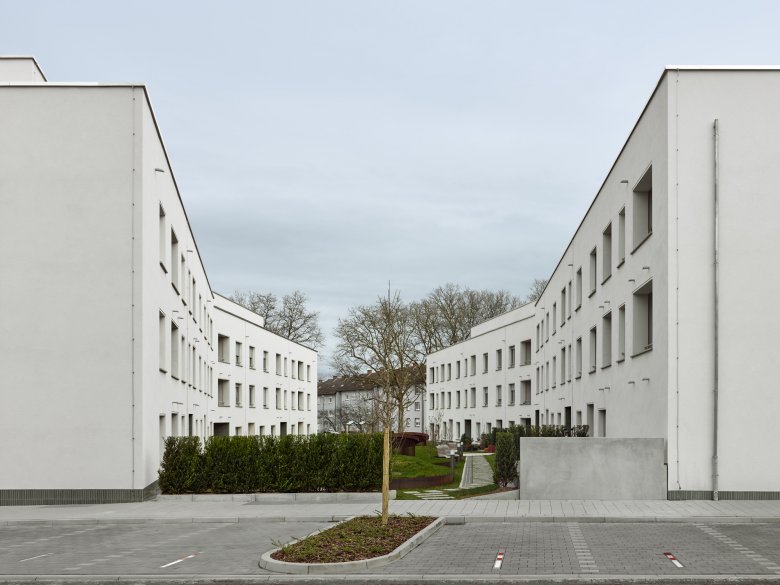
This screenshot has width=780, height=585. I want to click on doors, so click(469, 430), click(536, 418), click(566, 414), click(225, 428), click(190, 424), click(279, 424).